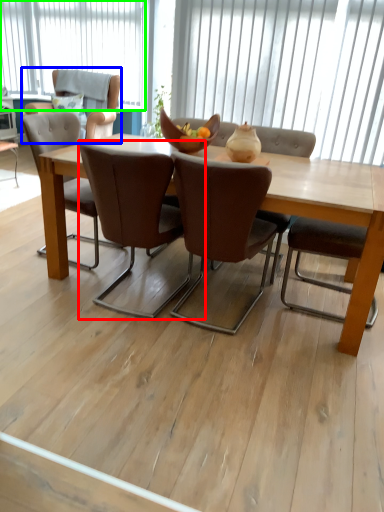
Question: Which is farther away from chair (highlighted by a red box)? armchair (highlighted by a blue box) or window (highlighted by a green box)?

Choices:
 (A) armchair
 (B) window

Answer: (B)